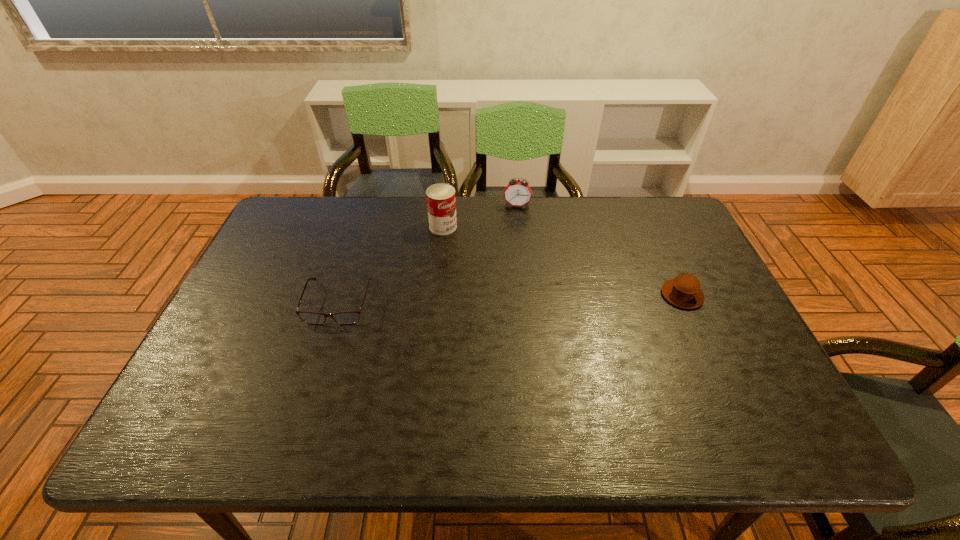
Identify the location of vacant space located on the clock face of the third object from left to right. The height and width of the screenshot is (540, 960). (509, 269).

Image resolution: width=960 pixels, height=540 pixels. Find the location of `vacant space located on the clock face of the third object from left to right`. vacant space located on the clock face of the third object from left to right is located at coordinates (515, 222).

I want to click on vacant area situated 0.240m on the clock face of the third object from left to right, so click(511, 256).

Locate an element on the screen. free space located on the front label of the can is located at coordinates (512, 274).

What are the coordinates of `free region located 0.320m on the front label of the can` in the screenshot? It's located at (527, 285).

The width and height of the screenshot is (960, 540). Identify the location of blank space located on the front label of the can. (476, 249).

Find the location of a particular element. alarm clock located at the far edge is located at coordinates (518, 193).

This screenshot has width=960, height=540. What are the coordinates of `can that is at the far edge` in the screenshot? It's located at (441, 201).

This screenshot has width=960, height=540. Identify the location of object that is at the right edge. (683, 291).

I want to click on free region at the far edge, so click(x=604, y=224).